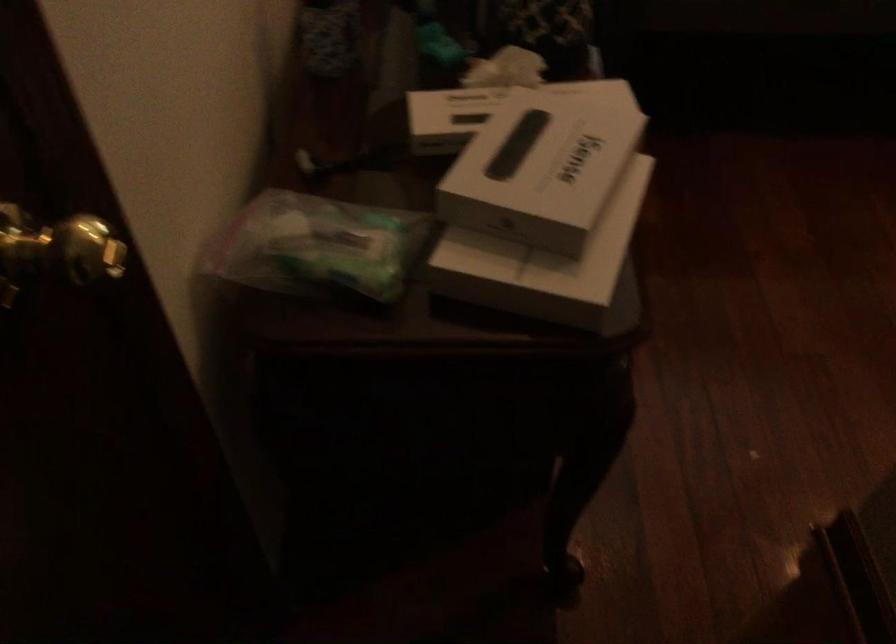
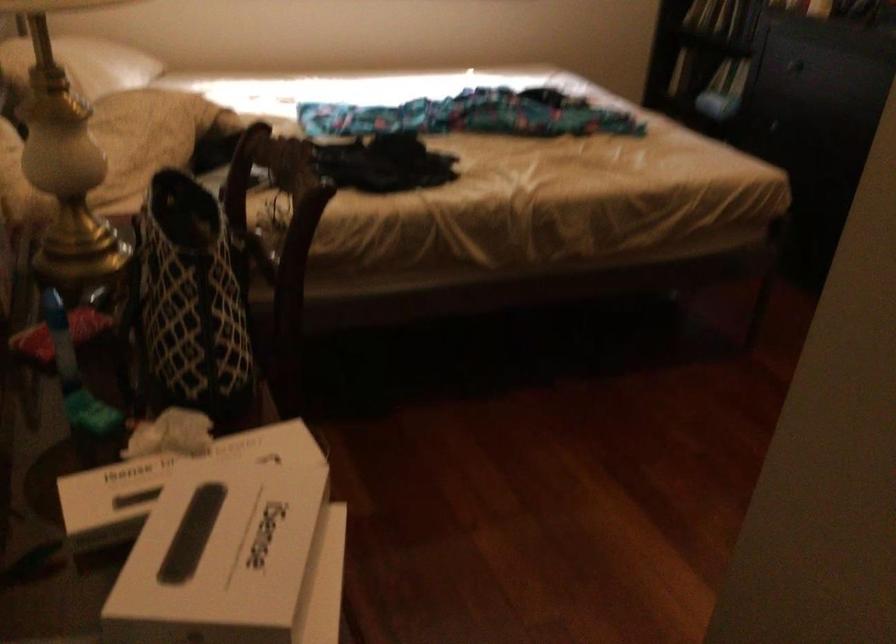
The images are taken continuously from a first-person perspective. In which direction is your viewpoint rotating?

The camera rotated toward right-up.